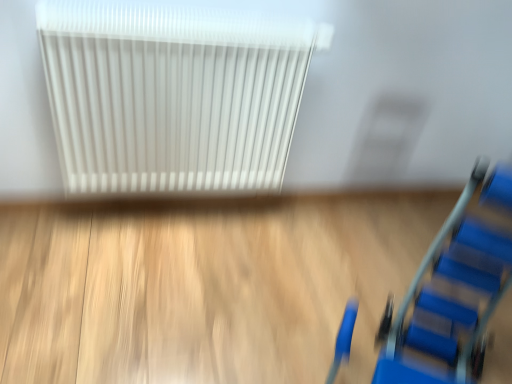
Identify the location of free space above white plastic radiator at upper center (from a real-world perspective). (194, 25).